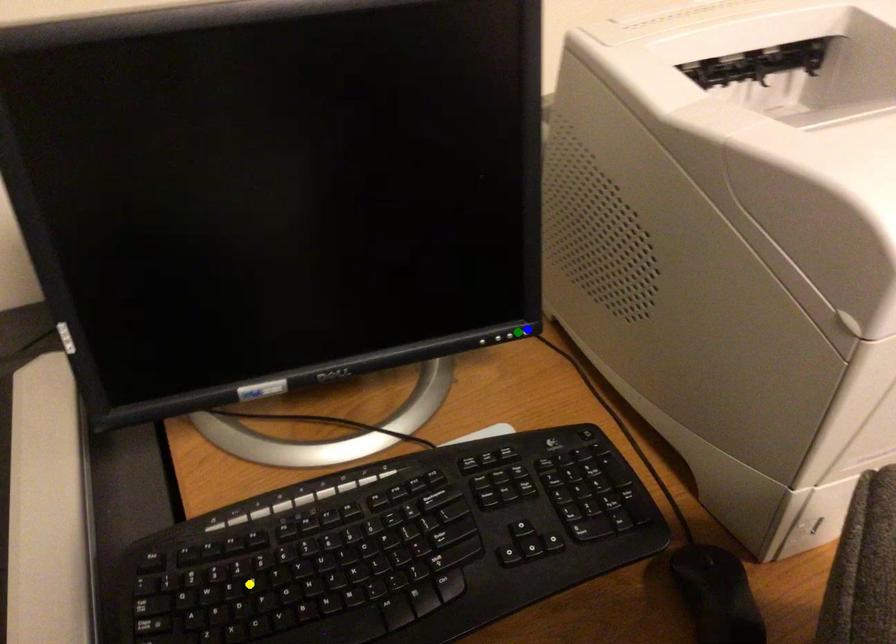
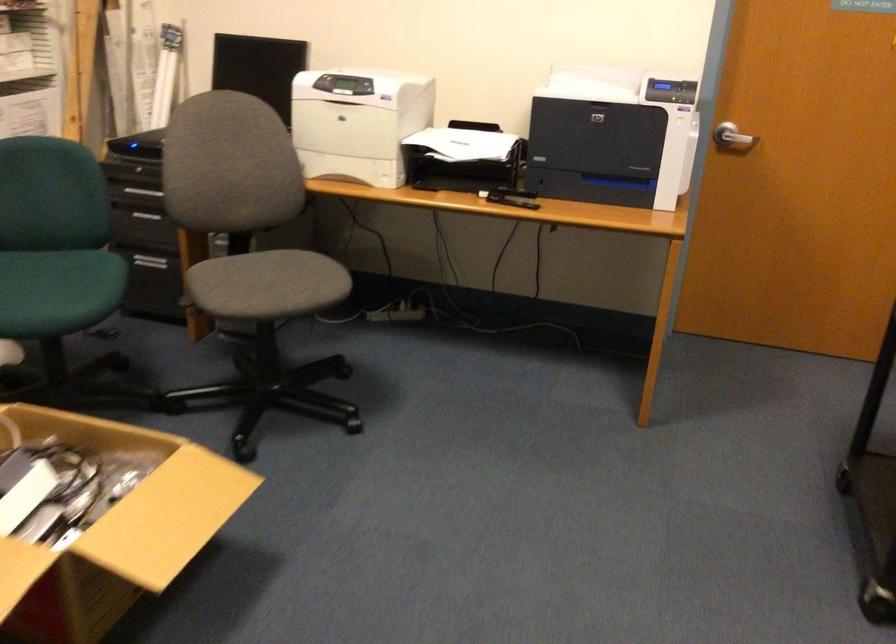
I am providing you with two images of the same scene from different viewpoints. Three points are marked in image1. Which point corresponds to a part or object that is occluded in image2?In image1, three points are marked. Which of them correspond to a part or object that is occluded in image2?Among the three points shown in image1, which one corresponds to a part or object that is no longer visible due to occlusion in image2?

yellow point, blue point, green point cannot be seen in image2.